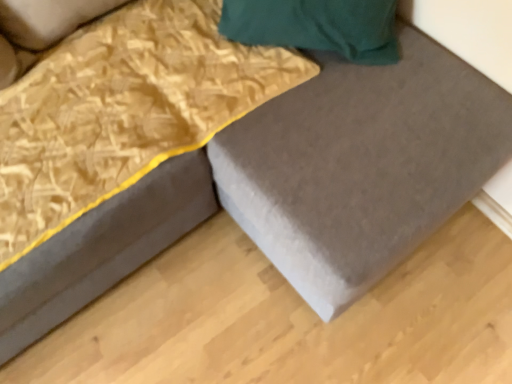
Describe the element at coordinates (123, 110) in the screenshot. I see `gold textured blanket at upper left` at that location.

Locate an element on the screen. This screenshot has height=384, width=512. matte gray bed frame at lower left is located at coordinates (102, 249).

Is matte gray plywood at lower right next to gold textured blanket at upper left?

No, matte gray plywood at lower right is not beside gold textured blanket at upper left.

Visually, is matte gray plywood at lower right positioned to the left or to the right of gold textured blanket at upper left?

In the image, matte gray plywood at lower right appears on the right side of gold textured blanket at upper left.

Can you confirm if matte gray plywood at lower right is thinner than gold textured blanket at upper left?

In fact, matte gray plywood at lower right might be wider than gold textured blanket at upper left.

Is gold textured blanket at upper left located within matte gray plywood at lower right?

No, gold textured blanket at upper left is located outside of matte gray plywood at lower right.

Is matte gray bed frame at lower left oriented away from gold textured blanket at upper left?

Absolutely, matte gray bed frame at lower left is directed away from gold textured blanket at upper left.

Does matte gray bed frame at lower left have a larger size compared to gold textured blanket at upper left?

Yes, matte gray bed frame at lower left is bigger than gold textured blanket at upper left.

Does point (158, 201) come in front of point (153, 167)?

No, it is behind (153, 167).

Locate an element on the screen. This screenshot has width=512, height=384. bed frame that is under the gold textured blanket at upper left (from a real-world perspective) is located at coordinates (102, 249).

From the image's perspective, which is below, gold textured blanket at upper left or matte gray bed frame at lower left?

From the image's view, matte gray bed frame at lower left is below.

How distant is gold textured blanket at upper left from matte gray bed frame at lower left?

gold textured blanket at upper left is 7.29 inches from matte gray bed frame at lower left.

Which is behind, gold textured blanket at upper left or matte gray bed frame at lower left?

Positioned behind is gold textured blanket at upper left.

Would you say matte gray bed frame at lower left is to the left or to the right of matte gray plywood at lower right in the picture?

From the image, it's evident that matte gray bed frame at lower left is to the left of matte gray plywood at lower right.

Is the position of matte gray bed frame at lower left less distant than that of matte gray plywood at lower right?

Yes, matte gray bed frame at lower left is in front of matte gray plywood at lower right.

How far apart are matte gray bed frame at lower left and matte gray plywood at lower right?

matte gray bed frame at lower left is 11.47 inches from matte gray plywood at lower right.

Between gold textured blanket at upper left and matte gray plywood at lower right, which one appears on the left side from the viewer's perspective?

From the viewer's perspective, gold textured blanket at upper left appears more on the left side.

Can you confirm if gold textured blanket at upper left is shorter than matte gray plywood at lower right?

No, gold textured blanket at upper left is not shorter than matte gray plywood at lower right.

Considering the sizes of objects gold textured blanket at upper left and matte gray plywood at lower right in the image provided, who is smaller, gold textured blanket at upper left or matte gray plywood at lower right?

matte gray plywood at lower right is smaller.

Are gold textured blanket at upper left and matte gray plywood at lower right far apart?

gold textured blanket at upper left is actually quite close to matte gray plywood at lower right.

Which is more to the right, matte gray plywood at lower right or matte gray bed frame at lower left?

matte gray plywood at lower right is more to the right.

Is matte gray bed frame at lower left a part of matte gray plywood at lower right?

Actually, matte gray bed frame at lower left is outside matte gray plywood at lower right.

Where is `plywood beneath the gold textured blanket at upper left (from a real-world perspective)`? plywood beneath the gold textured blanket at upper left (from a real-world perspective) is located at coordinates (290, 319).

Where is `blanket that is behind the matte gray bed frame at lower left`? blanket that is behind the matte gray bed frame at lower left is located at coordinates (123, 110).

Considering their positions, is matte gray plywood at lower right positioned further to gold textured blanket at upper left than matte gray bed frame at lower left?

matte gray plywood at lower right.

From the image, which object appears to be farther from matte gray bed frame at lower left, gold textured blanket at upper left or matte gray plywood at lower right?

matte gray plywood at lower right.

From the image, which object appears to be farther from matte gray plywood at lower right, gold textured blanket at upper left or matte gray bed frame at lower left?

gold textured blanket at upper left is positioned further to the anchor matte gray plywood at lower right.

Based on their spatial positions, is matte gray bed frame at lower left or gold textured blanket at upper left closer to matte gray plywood at lower right?

Based on the image, matte gray bed frame at lower left appears to be nearer to matte gray plywood at lower right.

When comparing their distances from gold textured blanket at upper left, does matte gray bed frame at lower left or matte gray plywood at lower right seem further?

matte gray plywood at lower right lies further to gold textured blanket at upper left than the other object.

Considering their positions, is matte gray plywood at lower right positioned closer to matte gray bed frame at lower left than gold textured blanket at upper left?

gold textured blanket at upper left is positioned closer to the anchor matte gray bed frame at lower left.

Identify the location of blanket between matte gray bed frame at lower left and matte gray plywood at lower right. The height and width of the screenshot is (384, 512). (123, 110).